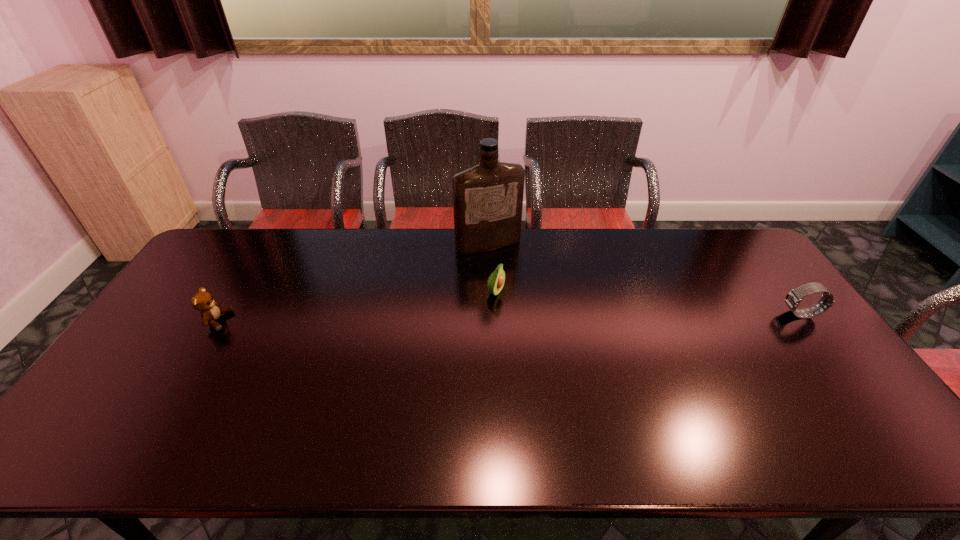
Where is `vacant region at the left edge of the desktop`? The image size is (960, 540). vacant region at the left edge of the desktop is located at coordinates (179, 312).

I want to click on free point at the right edge, so point(820,347).

Locate an element on the screen. The image size is (960, 540). vacant space at the far left corner is located at coordinates (253, 230).

I want to click on vacant space at the far right corner of the desktop, so click(x=722, y=253).

This screenshot has height=540, width=960. Find the location of `empty location between the avocado and the liquor`. empty location between the avocado and the liquor is located at coordinates [492, 269].

The height and width of the screenshot is (540, 960). I want to click on vacant region between the third nearest object and the leftmost object, so click(356, 307).

Identify the location of vacant area that lies between the farthest object and the leftmost object. This screenshot has height=540, width=960. click(352, 283).

I want to click on free space between the liquor and the second farthest object, so click(x=492, y=269).

At what (x,y) coordinates should I click in order to perform the action: click on vacant area that lies between the rightmost object and the tallest object. Please return your answer as a coordinate pair (x, y). This screenshot has height=540, width=960. Looking at the image, I should click on (644, 280).

The image size is (960, 540). In order to click on free space between the farthest object and the rightmost object in this screenshot , I will do `click(644, 280)`.